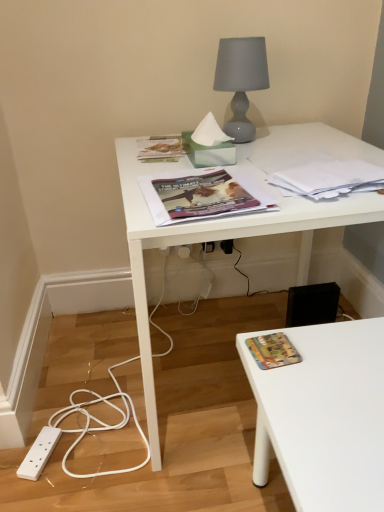
At what (x,y) coordinates should I click in order to perform the action: click on free location above white paper at upper right, which is counted as the first paperback book, starting from the front (from a real-world perspective). Please return your answer as a coordinate pair (x, y). The width and height of the screenshot is (384, 512). Looking at the image, I should click on (324, 173).